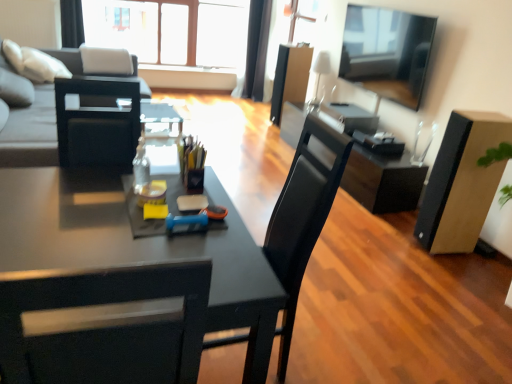
Question: Considering the relative sizes of brown cardboard box at right, the 1th box positioned from the front, and matte black chair at center in the image provided, is brown cardboard box at right, the 1th box positioned from the front, wider than matte black chair at center?

Choices:
 (A) yes
 (B) no

Answer: (B)

Question: From a real-world perspective, is brown cardboard box at right, which appears as the 1th box when ordered from the bottom, positioned under matte black chair at center based on gravity?

Choices:
 (A) yes
 (B) no

Answer: (A)

Question: Is matte black chair at center a part of brown cardboard box at right, which appears as the 1th box when ordered from the bottom?

Choices:
 (A) no
 (B) yes

Answer: (A)

Question: Is brown cardboard box at right, the first box in the right-to-left sequence, positioned far away from matte black chair at center?

Choices:
 (A) yes
 (B) no

Answer: (A)

Question: From the image's perspective, is brown cardboard box at right, which ranks as the 2th box in left-to-right order, above matte black chair at center?

Choices:
 (A) yes
 (B) no

Answer: (A)

Question: Considering the relative positions of brown cardboard box at right, which appears as the 1th box when ordered from the bottom, and matte black chair at center in the image provided, is brown cardboard box at right, which appears as the 1th box when ordered from the bottom, to the left of matte black chair at center from the viewer's perspective?

Choices:
 (A) no
 (B) yes

Answer: (A)

Question: Does white glossy lampshade at upper center touch flat screen tv at upper right?

Choices:
 (A) no
 (B) yes

Answer: (A)

Question: From a real-world perspective, is white glossy lampshade at upper center positioned over flat screen tv at upper right based on gravity?

Choices:
 (A) yes
 (B) no

Answer: (B)

Question: Is white glossy lampshade at upper center surrounding flat screen tv at upper right?

Choices:
 (A) yes
 (B) no

Answer: (B)

Question: Is white glossy lampshade at upper center outside of flat screen tv at upper right?

Choices:
 (A) yes
 (B) no

Answer: (A)

Question: Is white glossy lampshade at upper center oriented away from flat screen tv at upper right?

Choices:
 (A) yes
 (B) no

Answer: (B)

Question: Is white glossy lampshade at upper center smaller than flat screen tv at upper right?

Choices:
 (A) no
 (B) yes

Answer: (B)

Question: Is translucent glass bottle at center to the left of matte black desk at center from the viewer's perspective?

Choices:
 (A) yes
 (B) no

Answer: (B)